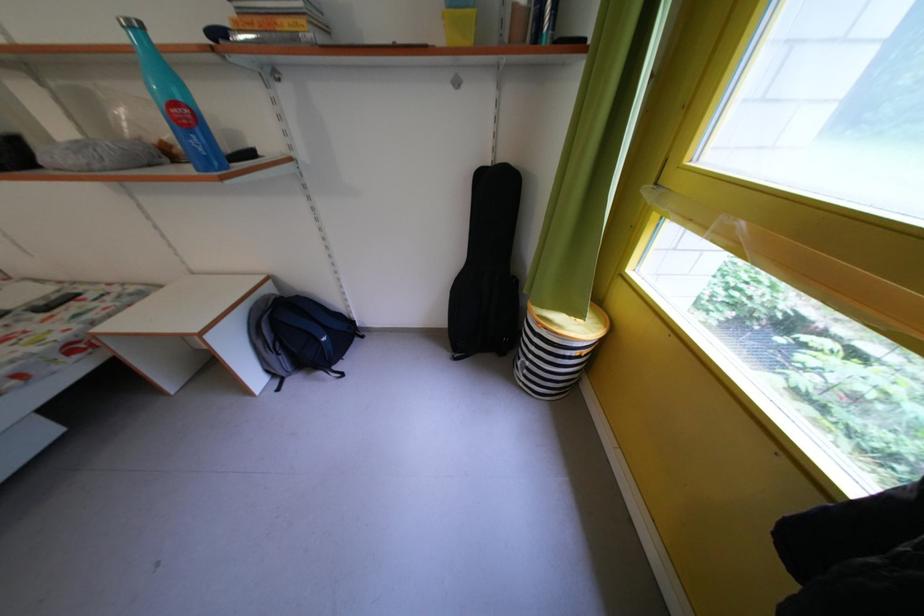
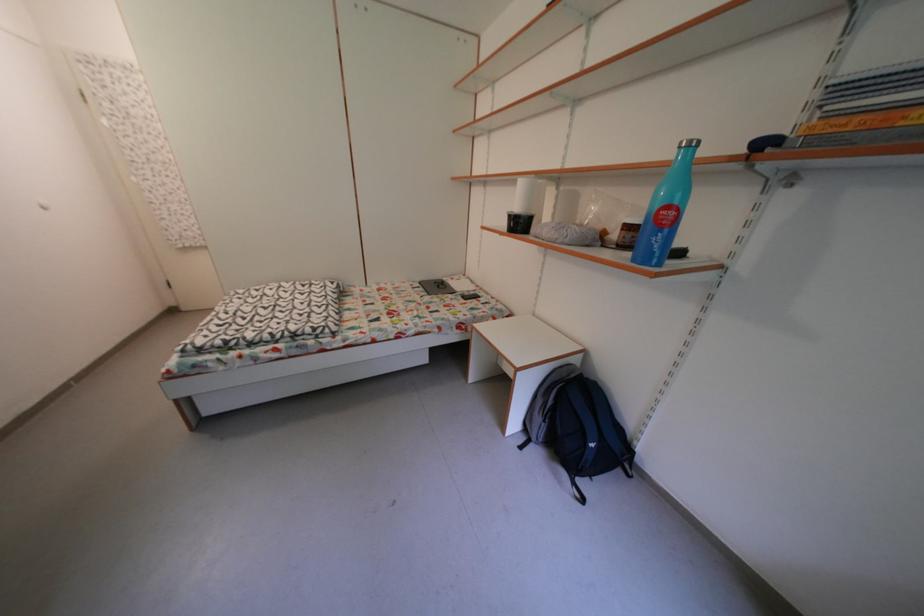
Question: How did the camera likely rotate?

Choices:
 (A) Left
 (B) Right
 (C) Up
 (D) Down

Answer: (A)